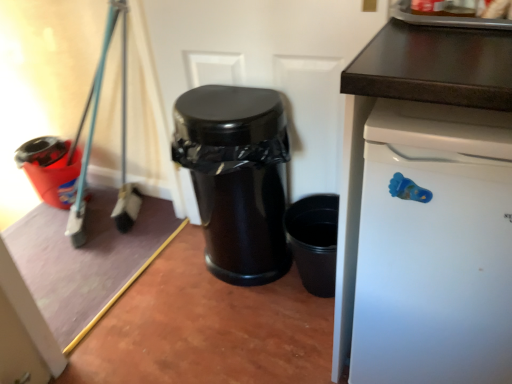
You are a GUI agent. You are given a task and a screenshot of the screen. Output one action in this format:
    pyautogui.click(x=<x>, y=<y>)
    Task: Click on the free space above glossy black trash can at center, which is the second waste container in back-to-front order (from a real-world perspective)
    
    Given the screenshot: What is the action you would take?
    pyautogui.click(x=224, y=103)